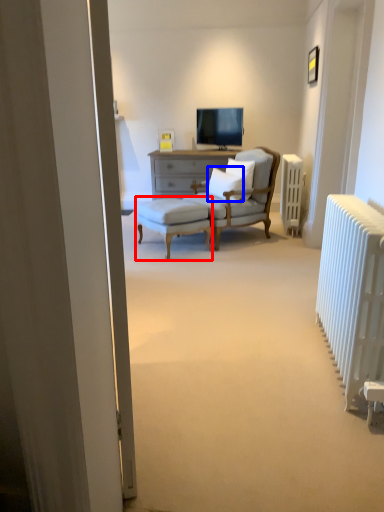
Question: Which object is closer to the camera taking this photo, stool (highlighted by a red box) or pillow (highlighted by a blue box)?

Choices:
 (A) stool
 (B) pillow

Answer: (A)